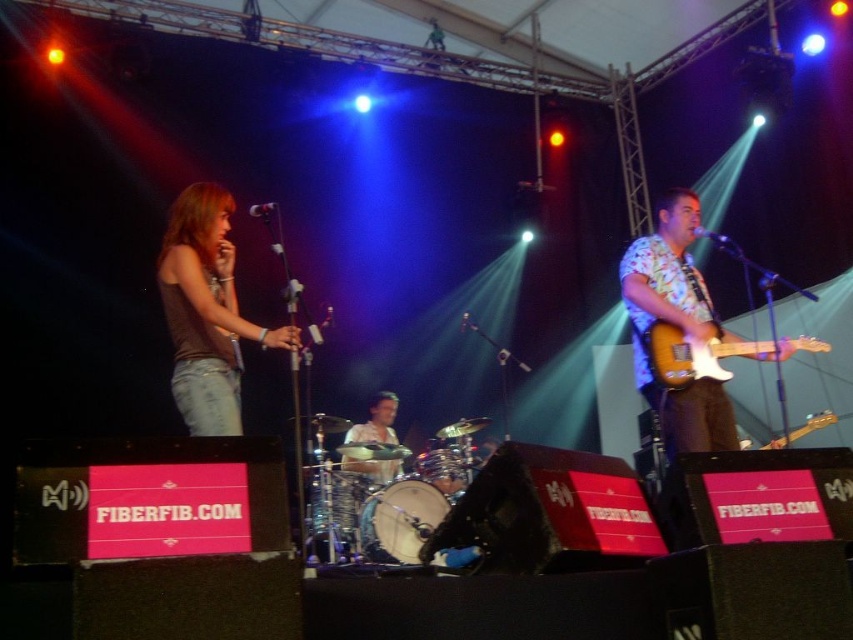
Question: Does brown denim jeans at left come in front of wooden electric guitar at right?

Choices:
 (A) no
 (B) yes

Answer: (B)

Question: Which of the following is the closest to the observer?

Choices:
 (A) (782, 435)
 (B) (224, 209)

Answer: (B)

Question: Among these points, which one is nearest to the camera?

Choices:
 (A) (786, 433)
 (B) (631, 252)
 (C) (213, 184)

Answer: (C)

Question: Is floral fabric guitar at right below glossy wood electric guitar at right?

Choices:
 (A) yes
 (B) no

Answer: (B)

Question: Is floral fabric guitar at right to the left of glossy wood electric guitar at right from the viewer's perspective?

Choices:
 (A) yes
 (B) no

Answer: (A)

Question: Which object is the closest to the floral fabric guitar at right?

Choices:
 (A) brown denim jeans at left
 (B) smooth skin drum at center
 (C) wooden electric guitar at right
 (D) glossy wood electric guitar at right

Answer: (D)